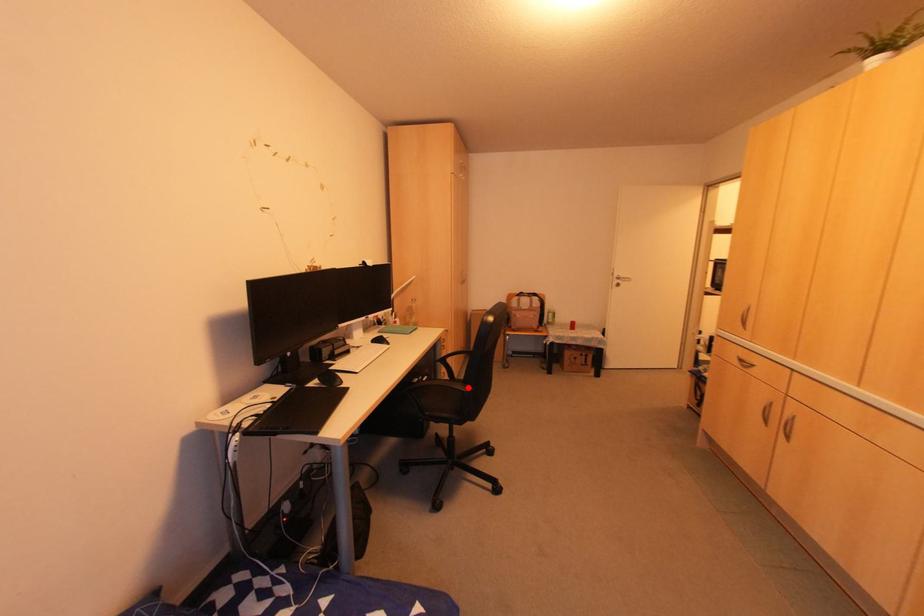
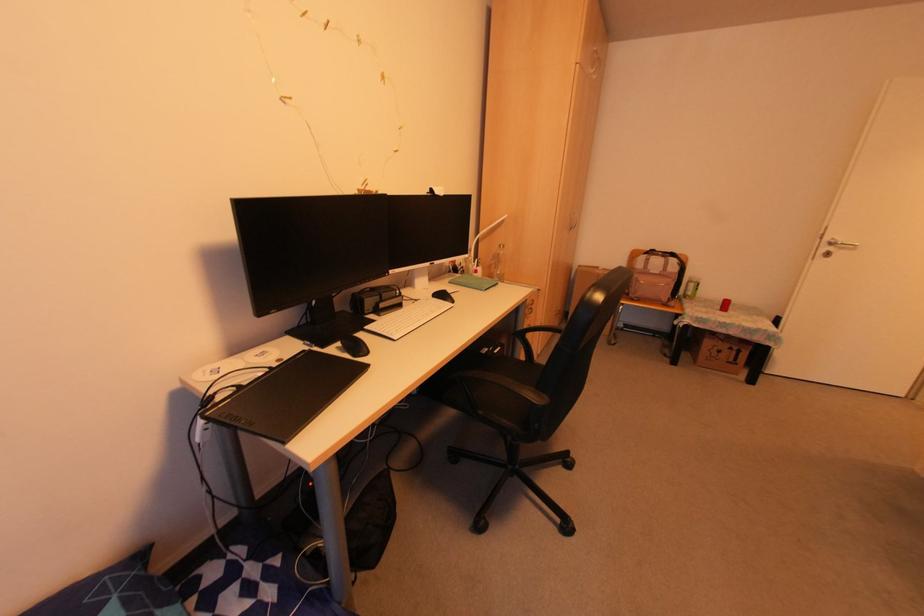
In the second image, find the point that corresponds to the highlighted location in the first image.

(541, 397)